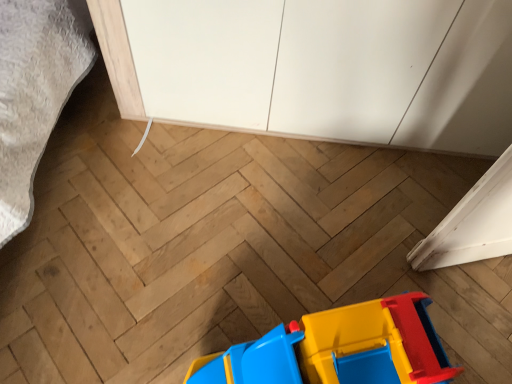
Question: Is white matte cabinet at upper center bigger or smaller than matte plastic toy at lower center?

Choices:
 (A) big
 (B) small

Answer: (A)

Question: Is white matte cabinet at upper center to the left or to the right of matte plastic toy at lower center in the image?

Choices:
 (A) left
 (B) right

Answer: (B)

Question: Considering their positions, is white matte cabinet at upper center located in front of or behind matte plastic toy at lower center?

Choices:
 (A) front
 (B) behind

Answer: (B)

Question: Is point (436, 342) closer or farther from the camera than point (398, 122)?

Choices:
 (A) closer
 (B) farther

Answer: (A)

Question: From a real-world perspective, relative to white matte cabinet at upper center, is matte plastic toy at lower center vertically above or below?

Choices:
 (A) above
 (B) below

Answer: (B)

Question: In terms of height, does matte plastic toy at lower center look taller or shorter compared to white matte cabinet at upper center?

Choices:
 (A) tall
 (B) short

Answer: (B)

Question: In terms of width, does matte plastic toy at lower center look wider or thinner when compared to white matte cabinet at upper center?

Choices:
 (A) wide
 (B) thin

Answer: (B)